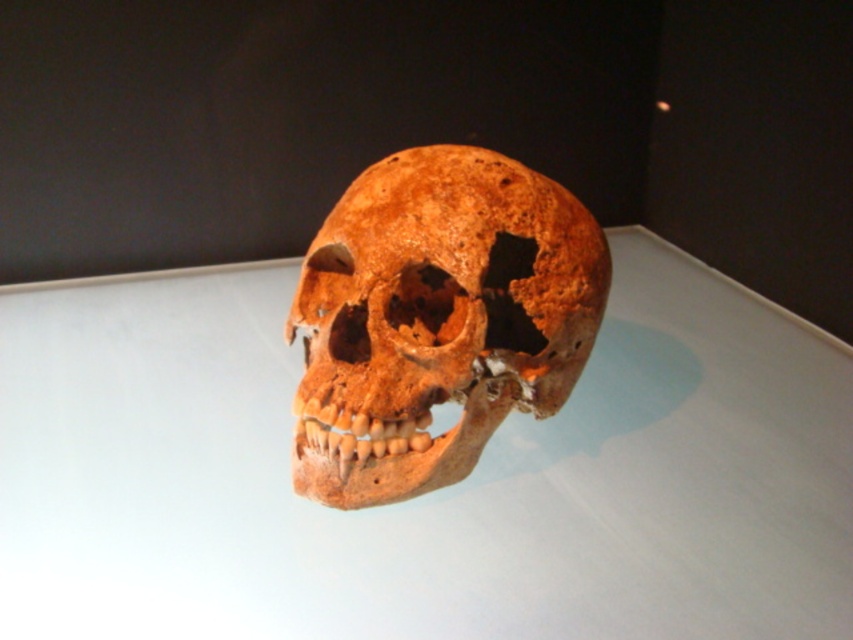
Question: Where is white glossy table at center located in relation to brown matte skull at center in the image?

Choices:
 (A) below
 (B) above

Answer: (A)

Question: Is white glossy table at center above brown matte skull at center?

Choices:
 (A) yes
 (B) no

Answer: (B)

Question: Which point appears closest to the camera in this image?

Choices:
 (A) (22, 304)
 (B) (527, 246)

Answer: (B)

Question: Is white glossy table at center positioned before brown matte skull at center?

Choices:
 (A) yes
 (B) no

Answer: (B)

Question: Which object appears closest to the camera in this image?

Choices:
 (A) white glossy table at center
 (B) brown matte skull at center

Answer: (B)